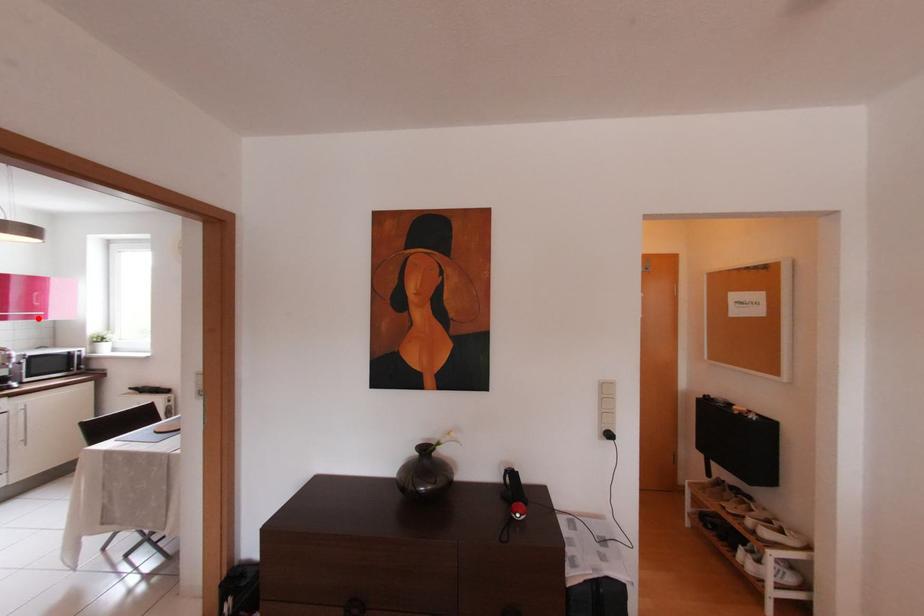
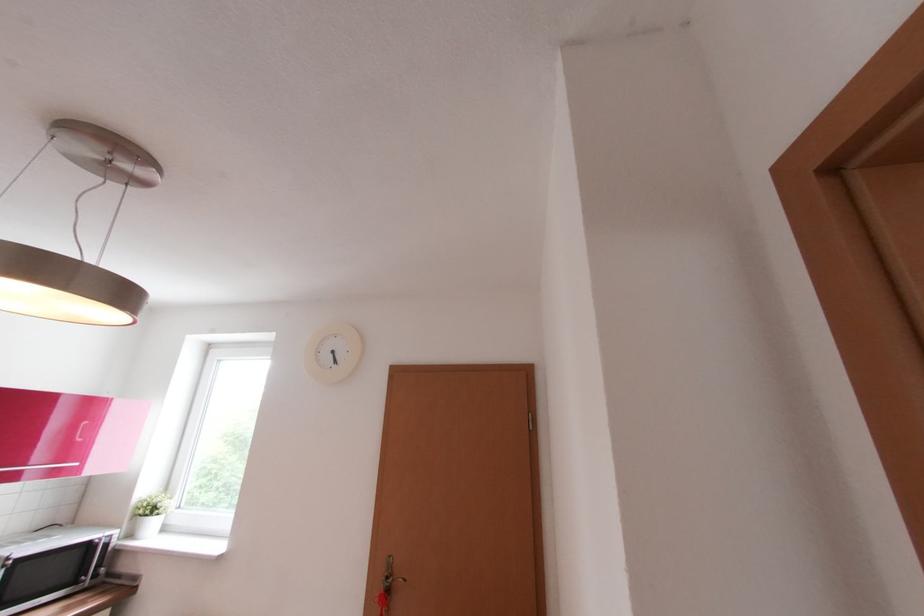
Question: I am providing you with two images of the same scene from different viewpoints. Given a red point in image1, look at the same physical point in image2. Is it:

Choices:
 (A) Closer to the viewpoint
 (B) Farther from the viewpoint

Answer: (A)